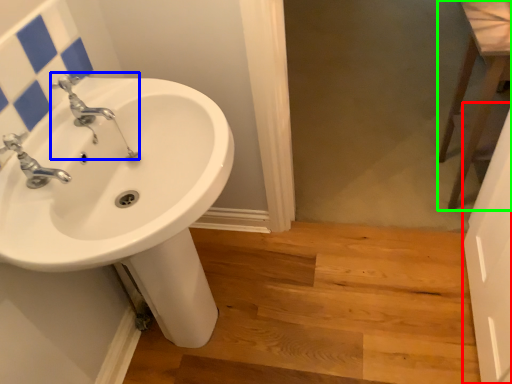
Question: Which object is the farthest from screen door (highlighted by a red box)? Choose among these: plumbing fixture (highlighted by a blue box) or level (highlighted by a green box).

Choices:
 (A) plumbing fixture
 (B) level

Answer: (A)